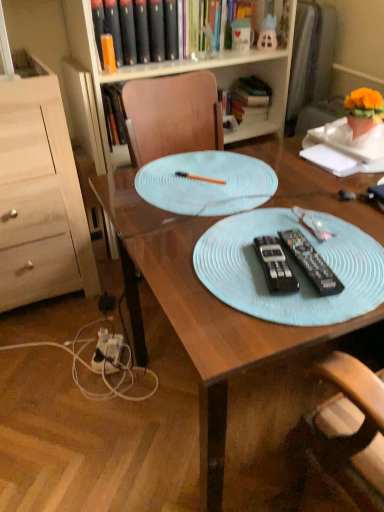
Identify the location of vacant area that lies between black plastic remote control at center, marked as the second remote control in a right-to-left arrangement, and white paper at upper right. (312, 201).